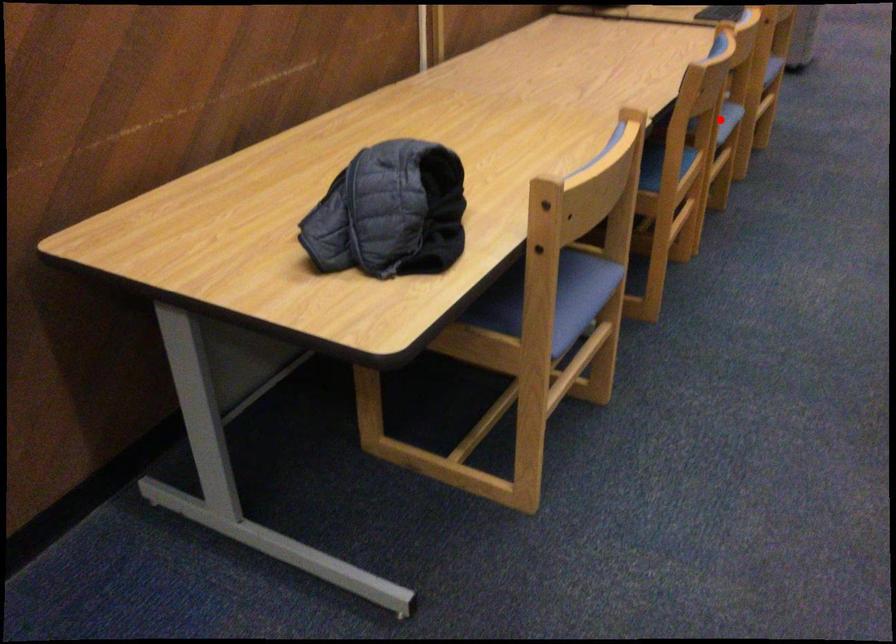
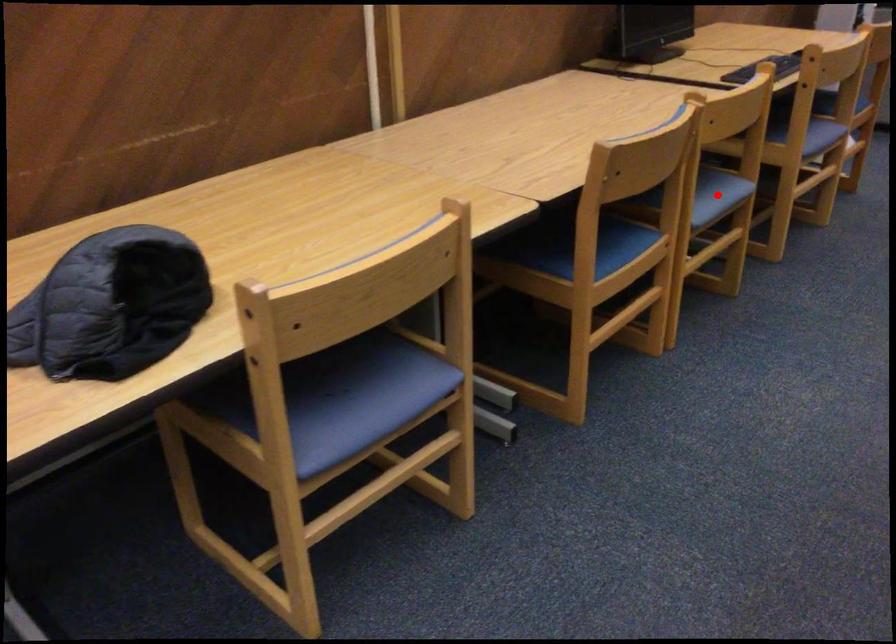
I am providing you with two images of the same scene from different viewpoints. A red point is marked on the first image and another point is marked on the second image. Does the point marked in image1 correspond to the same location as the one in image2?

Yes